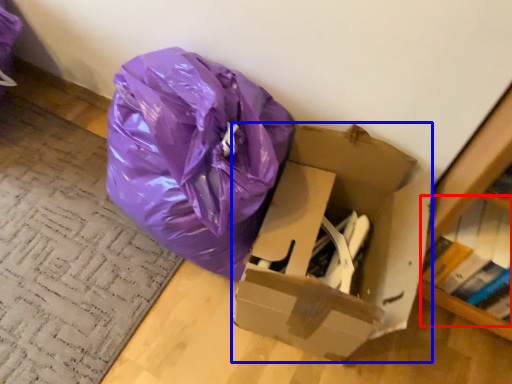
Question: Which object appears closest to the camera in this image, book (highlighted by a red box) or box (highlighted by a blue box)?

Choices:
 (A) book
 (B) box

Answer: (B)